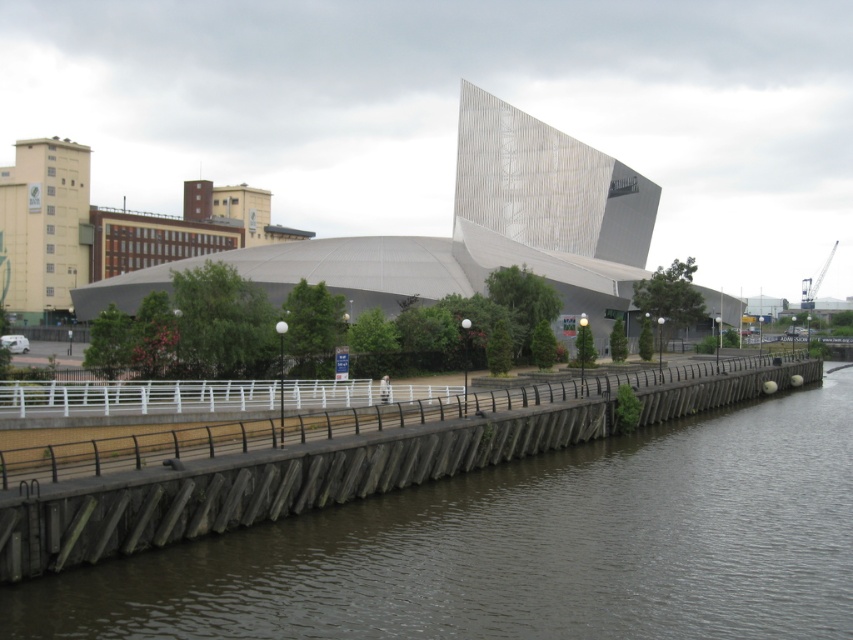
Question: Does brown concrete river at lower left appear on the left side of white concrete bridge at center?

Choices:
 (A) yes
 (B) no

Answer: (B)

Question: Which of the following is the closest to the observer?

Choices:
 (A) (238, 250)
 (B) (544, 572)

Answer: (B)

Question: Is brown concrete river at lower left to the left of white concrete bridge at center from the viewer's perspective?

Choices:
 (A) no
 (B) yes

Answer: (A)

Question: Which object appears closest to the camera in this image?

Choices:
 (A) white concrete bridge at center
 (B) brown concrete river at lower left

Answer: (B)

Question: From the image, what is the correct spatial relationship of brown concrete river at lower left in relation to white concrete bridge at center?

Choices:
 (A) above
 (B) below

Answer: (B)